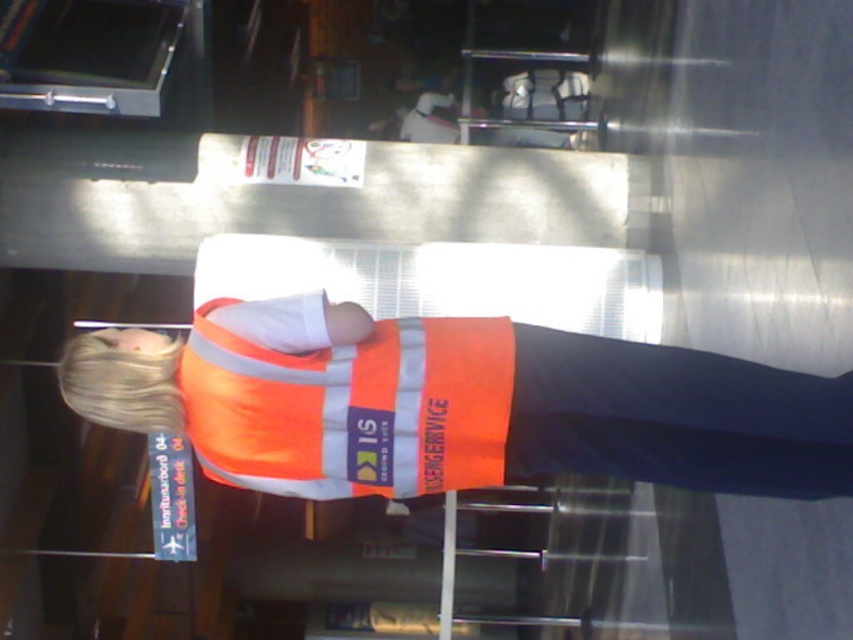
You are a security guard in the area and need to identify the staff member with the larger vest. Which object corresponds to the reflective orange vest at center or the orange reflective vest at center?

The reflective orange vest at center has a larger size compared to the orange reflective vest at center, so the staff member wearing the reflective orange vest at center has the larger vest.

You are a passenger at the check in desk and see the reflective orange vest at center and the orange reflective vest at center. Which one is shorter?

The reflective orange vest at center is shorter than the orange reflective vest at center.

You are a security guard in the airport and need to determine if the reflective orange vest at center is wider than the orange reflective vest at center. Which one is wider?

The reflective orange vest at center is wider than the orange reflective vest at center according to the description.